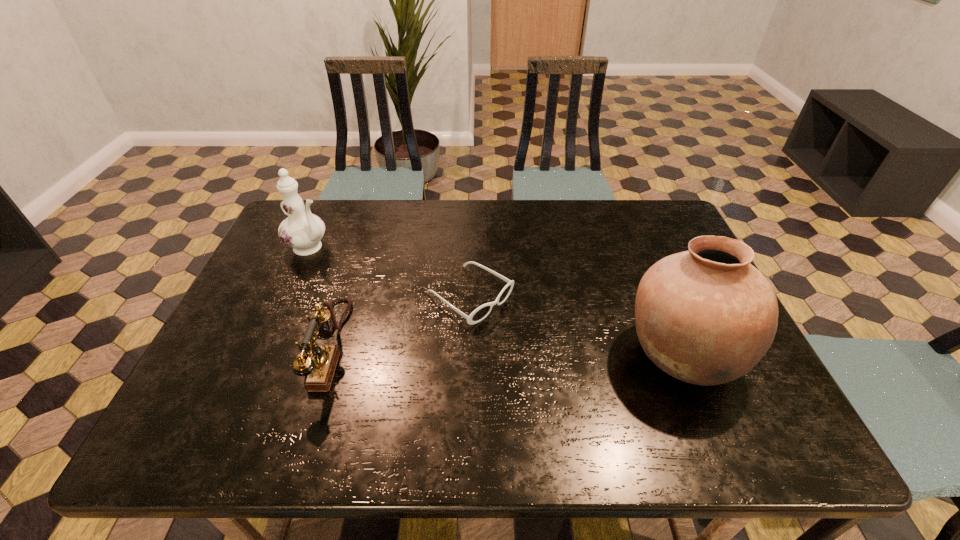
The height and width of the screenshot is (540, 960). I want to click on vacant region located on the left of the rightmost object, so click(x=561, y=354).

Identify the location of vacant area situated 0.260m with the lenses of the second object from right to left facing outward. (592, 376).

Where is `vacant region located 0.270m with the lenses of the second object from right to left facing outward`? This screenshot has height=540, width=960. vacant region located 0.270m with the lenses of the second object from right to left facing outward is located at coordinates (596, 379).

Find the location of a particular element. The width and height of the screenshot is (960, 540). vacant space located with the lenses of the second object from right to left facing outward is located at coordinates (585, 372).

Where is `vacant region located at the spout of the farthest object`? vacant region located at the spout of the farthest object is located at coordinates (412, 304).

The height and width of the screenshot is (540, 960). In order to click on blank area located at the spout of the farthest object in this screenshot , I will do `click(388, 290)`.

In order to click on vacant space situated at the spout of the farthest object in this screenshot , I will do `click(360, 274)`.

Where is `object present at the far edge`? object present at the far edge is located at coordinates (302, 231).

This screenshot has width=960, height=540. What are the coordinates of `telephone that is positioned at the near edge` in the screenshot? It's located at (319, 363).

Locate an element on the screen. pottery located in the near edge section of the desktop is located at coordinates (706, 316).